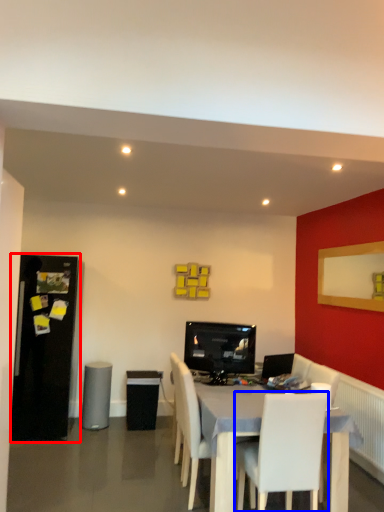
Question: Which object is further to the camera taking this photo, fridge (highlighted by a red box) or chair (highlighted by a blue box)?

Choices:
 (A) fridge
 (B) chair

Answer: (A)